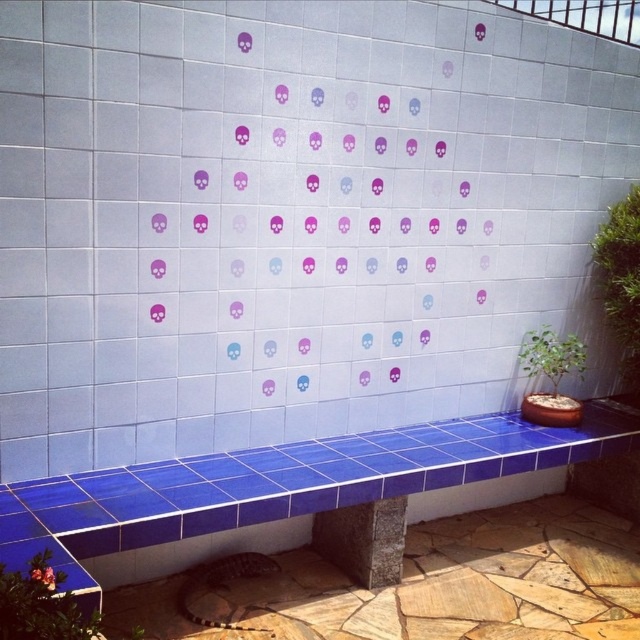
Question: Is blue ceramic bench at center in front of green leafy plant at lower left?

Choices:
 (A) no
 (B) yes

Answer: (A)

Question: Considering the relative positions of blue ceramic bench at center and green leafy plant at lower left in the image provided, where is blue ceramic bench at center located with respect to green leafy plant at lower left?

Choices:
 (A) below
 (B) above

Answer: (B)

Question: Which point is closer to the camera?

Choices:
 (A) (260, 506)
 (B) (35, 602)

Answer: (B)

Question: Is blue ceramic bench at center positioned in front of green leafy plant at lower left?

Choices:
 (A) no
 (B) yes

Answer: (A)